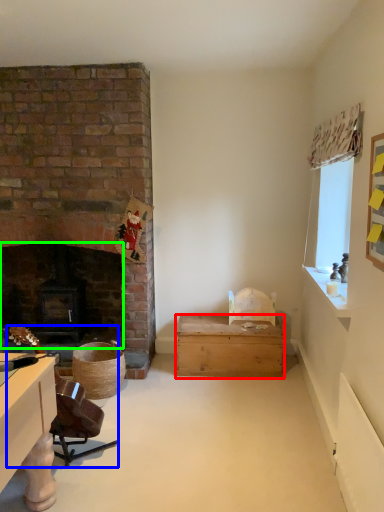
Question: Considering the real-world distances, which object is farthest from box (highlighted by a red box)? swivel chair (highlighted by a blue box) or fireplace (highlighted by a green box)?

Choices:
 (A) swivel chair
 (B) fireplace

Answer: (A)